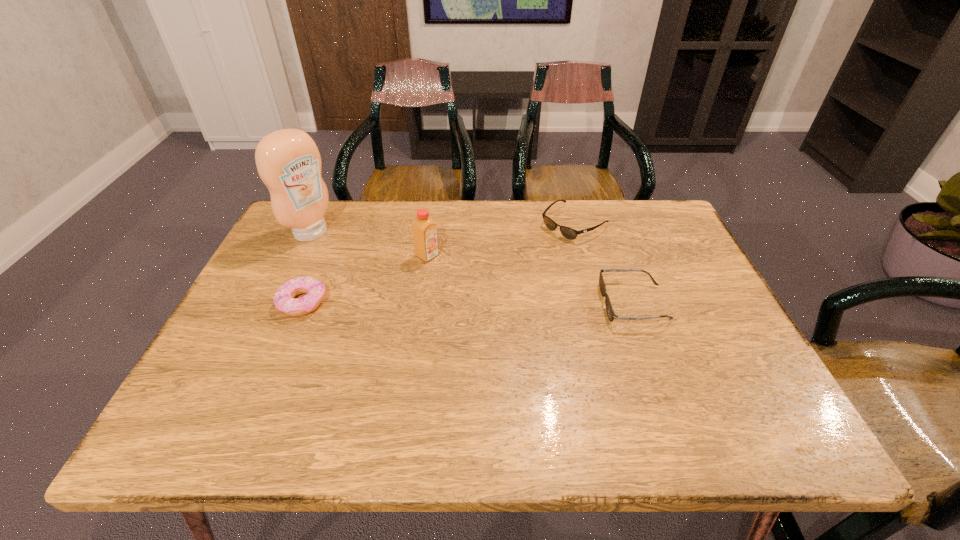
Identify the location of vacant space on the desktop that is between the doughnut and the nearer sunglasses and is positioned on the front and back of the third object from right to left. (510, 303).

Image resolution: width=960 pixels, height=540 pixels. In order to click on free space on the desktop that is between the doughnut and the nearer sunglasses and is positioned on the front-facing side of the farther sunglasses in this screenshot , I will do `click(463, 302)`.

Find the location of a particular element. The width and height of the screenshot is (960, 540). free space on the desktop that is between the doughnut and the nearer sunglasses and is positioned on the label of the condiment is located at coordinates [x=429, y=302].